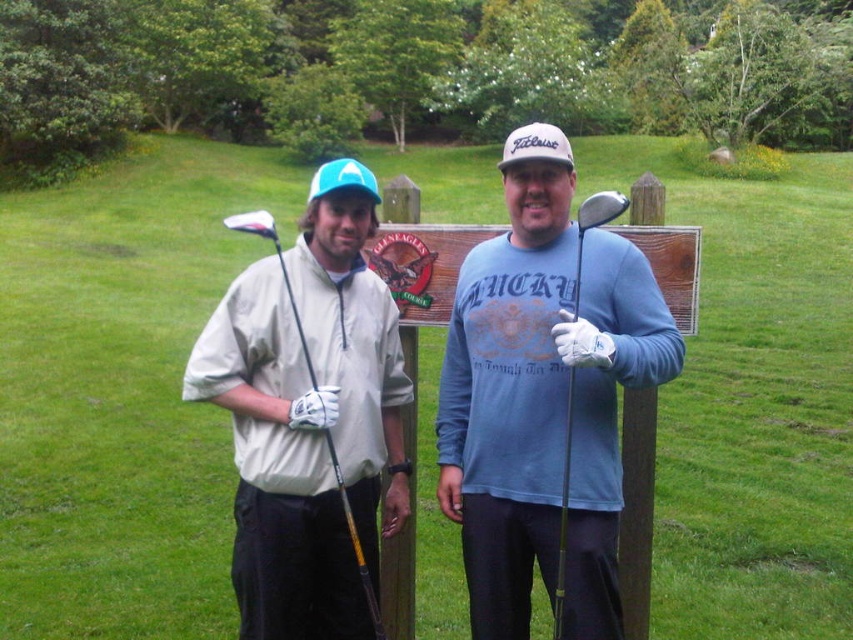
You are a golf caddy carrying a bag that is 24 centimeters wide. You need to place your bag between the matte blue shirt at center and the shiny silver golf club at center. Will the bag fit in the space between them?

The distance between the matte blue shirt at center and the shiny silver golf club at center is 23.96 centimeters. Since the bag is 24 centimeters wide, it will not fit in the space between them as the distance is slightly less than the bag width.

You are a photographer positioned behind the two golfers. You want to take a photo of the shiny silver golf club at center and the matte black golf club at left. Which golf club will appear larger in the photo?

The shiny silver golf club at center will appear larger in the photo because it is closer to the viewer than the matte black golf club at left.

You are a golf cart driver who needs to park between the shiny silver golf club at center and the matte black golf club at left. The golf cart is 2.5 meters long. Can you park the golf cart between them without overlapping either club?

The distance between the shiny silver golf club at center and the matte black golf club at left is 2.88 meters. Since the golf cart is 2.5 meters long, there is enough space to park between them without overlapping either club.